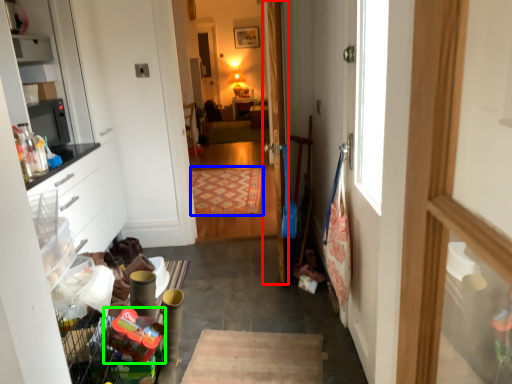
Question: Which object is positioned closest to door (highlighted by a red box)? Select from mat (highlighted by a blue box) and toy (highlighted by a green box).

Choices:
 (A) mat
 (B) toy

Answer: (B)